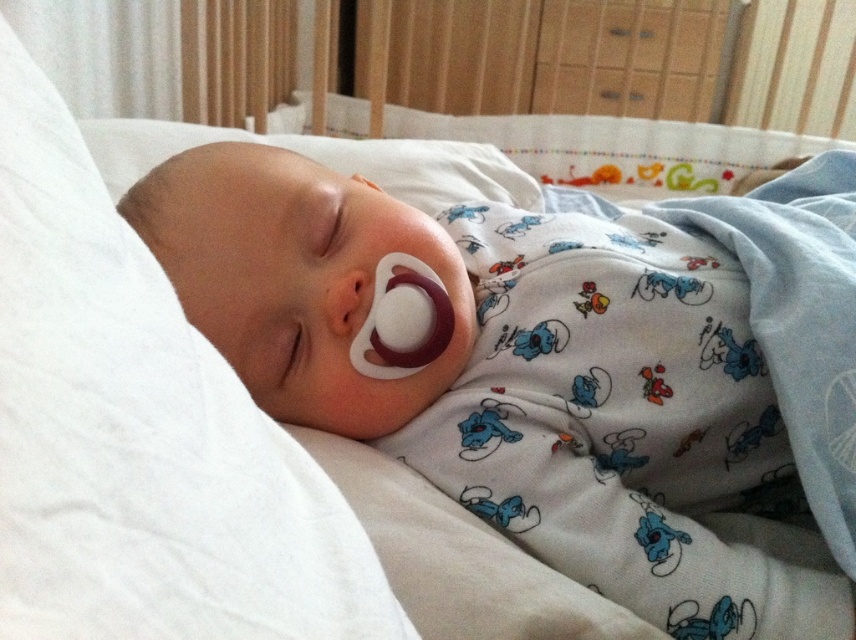
You are a parent trying to place two pacifiers in the baby crib. The first pacifier is the white soft pacifier at center and the second is the smooth white pacifier at center. If you want to place them side by side without overlapping, what is the minimum distance you need between them?

The minimum distance needed between the white soft pacifier at center and the smooth white pacifier at center should be at least 8.10 inches to prevent overlapping.

Consider the image. You are a parent checking on your sleeping baby. You notice two pacifiers in the crib. The baby has one in their mouth. Which pacifier is taller, the white soft pacifier at center or the smooth white pacifier at center?

The white soft pacifier at center is taller than the smooth white pacifier at center.

You are a nurse checking on a sleeping baby. You notice two pacifiers in the crib. One is labeled as the white soft pacifier at center and the other as the smooth white pacifier at center. Which pacifier is located to the right of the other?

The white soft pacifier at center is located to the right of the smooth white pacifier at center.